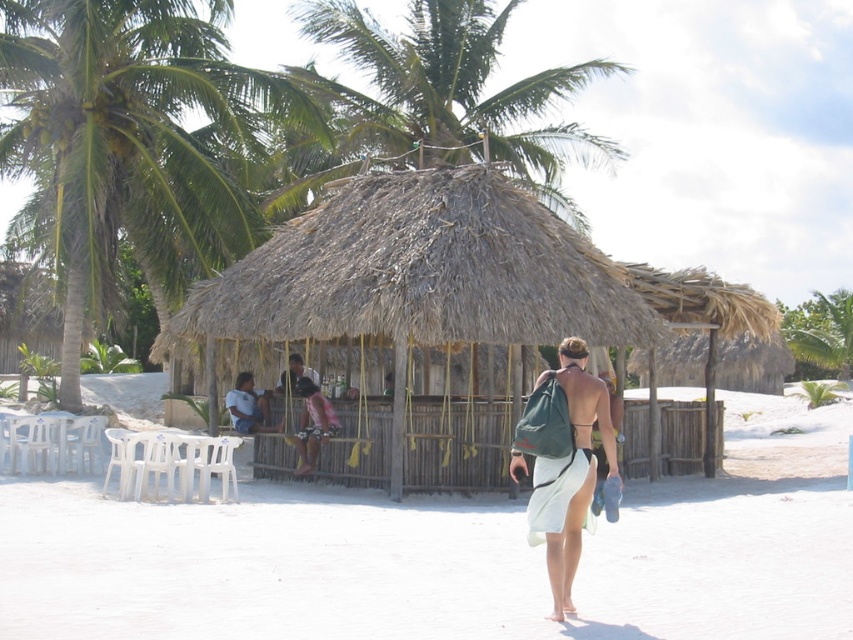
Question: Observing the image, what is the correct spatial positioning of white plastic chairs at lower left in reference to green leafy palm tree at left?

Choices:
 (A) right
 (B) left

Answer: (A)

Question: Can you confirm if green fabric backpack at center is positioned to the left of green leafy palm tree at upper right?

Choices:
 (A) yes
 (B) no

Answer: (A)

Question: Where is thatched straw hut at center located in relation to green leafy palm tree at left in the image?

Choices:
 (A) right
 (B) left

Answer: (A)

Question: Among these points, which one is nearest to the camera?

Choices:
 (A) (193, 13)
 (B) (292, 528)

Answer: (B)

Question: Which object is farther from the camera taking this photo?

Choices:
 (A) green fabric backpack at center
 (B) green leafy palm tree at left
 (C) green leafy palm tree at upper center

Answer: (B)

Question: Estimate the real-world distances between objects in this image. Which object is closer to the green leafy palm tree at left?

Choices:
 (A) white plastic chairs at lower left
 (B) thatched straw hut at center

Answer: (A)